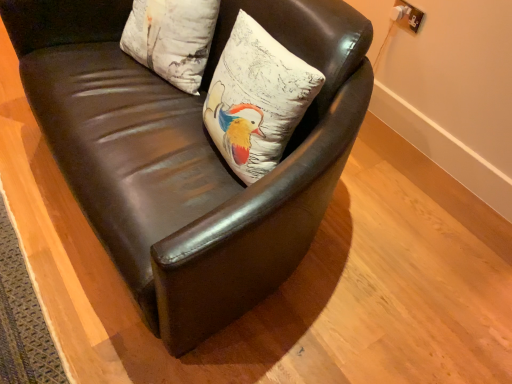
Question: Does white textured pillow at upper center, marked as the 2th pillow in a right-to-left arrangement, have a greater height compared to brown leather chair at center?

Choices:
 (A) yes
 (B) no

Answer: (B)

Question: Does white textured pillow at upper center, marked as the 2th pillow in a right-to-left arrangement, have a smaller size compared to brown leather chair at center?

Choices:
 (A) yes
 (B) no

Answer: (A)

Question: Is white textured pillow at upper center, placed as the first pillow when sorted from left to right, facing away from brown leather chair at center?

Choices:
 (A) yes
 (B) no

Answer: (A)

Question: Does white textured pillow at upper center, placed as the first pillow when sorted from left to right, have a lesser width compared to brown leather chair at center?

Choices:
 (A) no
 (B) yes

Answer: (B)

Question: From the image's perspective, would you say white textured pillow at upper center, marked as the 2th pillow in a right-to-left arrangement, is shown under brown leather chair at center?

Choices:
 (A) yes
 (B) no

Answer: (B)

Question: Do you think white textured pillow at upper center, marked as the 2th pillow in a right-to-left arrangement, is within white matte pillow at center, which is the 2th pillow in left-to-right order, or outside of it?

Choices:
 (A) inside
 (B) outside

Answer: (B)

Question: Is point (133, 44) positioned closer to the camera than point (244, 56)?

Choices:
 (A) farther
 (B) closer

Answer: (A)

Question: Is white textured pillow at upper center, marked as the 2th pillow in a right-to-left arrangement, wider or thinner than white matte pillow at center, which is the 2th pillow in left-to-right order?

Choices:
 (A) wide
 (B) thin

Answer: (B)

Question: Based on their sizes in the image, would you say white textured pillow at upper center, marked as the 2th pillow in a right-to-left arrangement, is bigger or smaller than white matte pillow at center, the 1th pillow viewed from the right?

Choices:
 (A) big
 (B) small

Answer: (B)

Question: Looking at their shapes, would you say white textured pillow at upper center, marked as the 2th pillow in a right-to-left arrangement, is wider or thinner than brown leather chair at center?

Choices:
 (A) thin
 (B) wide

Answer: (A)

Question: Is white textured pillow at upper center, marked as the 2th pillow in a right-to-left arrangement, bigger or smaller than brown leather chair at center?

Choices:
 (A) big
 (B) small

Answer: (B)

Question: Considering the positions of white textured pillow at upper center, marked as the 2th pillow in a right-to-left arrangement, and brown leather chair at center in the image, is white textured pillow at upper center, marked as the 2th pillow in a right-to-left arrangement, taller or shorter than brown leather chair at center?

Choices:
 (A) tall
 (B) short

Answer: (B)

Question: Visually, is white textured pillow at upper center, marked as the 2th pillow in a right-to-left arrangement, positioned to the left or to the right of brown leather chair at center?

Choices:
 (A) right
 (B) left

Answer: (B)

Question: Relative to white textured pillow at upper center, marked as the 2th pillow in a right-to-left arrangement, is white matte pillow at center, the 1th pillow viewed from the right, in front or behind?

Choices:
 (A) front
 (B) behind

Answer: (A)

Question: In terms of size, does white matte pillow at center, which is the 2th pillow in left-to-right order, appear bigger or smaller than white textured pillow at upper center, placed as the first pillow when sorted from left to right?

Choices:
 (A) big
 (B) small

Answer: (A)